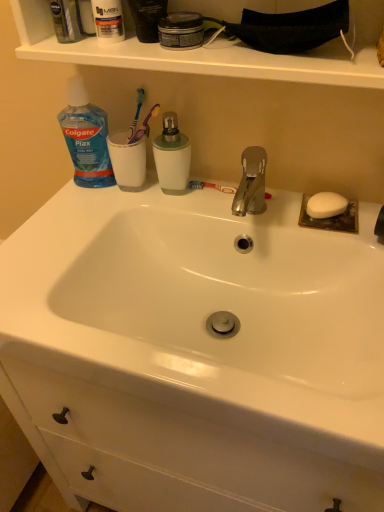
Locate an element on the screen. The width and height of the screenshot is (384, 512). empty space that is in between blue plastic toothbrush at upper center and white matte soap at right is located at coordinates (244, 198).